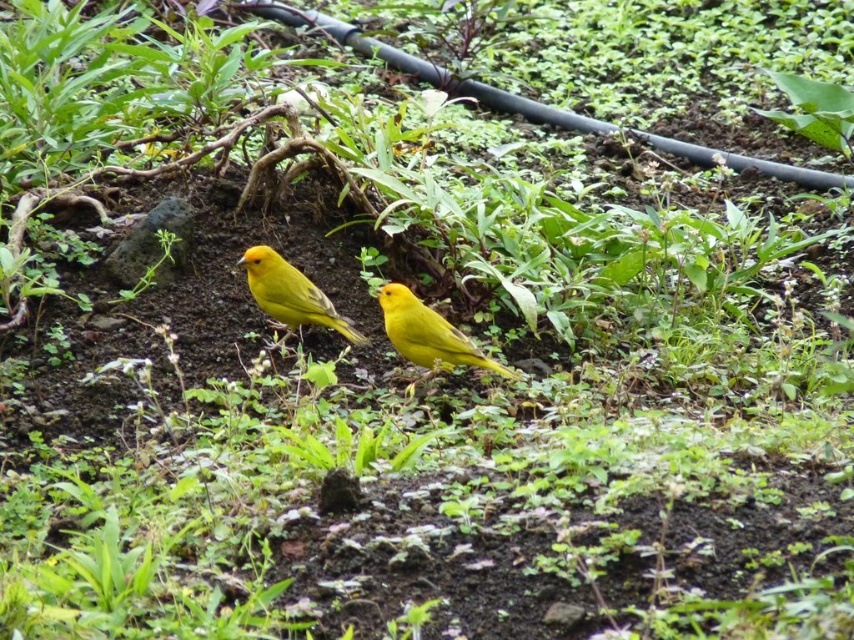
You are a photographer aiming to capture a closeup shot of the bright yellow bird at center. Based on the scene description, what is the exact coordinate where you should focus your camera?

The bright yellow bird at center is located at coordinate point (427,336) so you should focus your camera there.

You are standing in the garden and want to place a small bird feeder exactly at the point marked by point (455, 330). If you are currently 3 meters away from that point, how many more meters do you need to move forward to reach the exact location?

The point (455, 330) is 3.35 meters from the viewer. Since you are currently 3 meters away, you need to move forward 0.35 more meters to reach it.